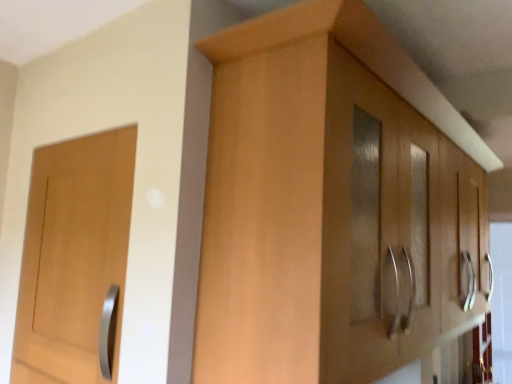
Question: Could you tell me if light wood cabinet at center is facing matte wood door at left?

Choices:
 (A) no
 (B) yes

Answer: (A)

Question: Considering the relative positions of light wood cabinet at center and matte wood door at left in the image provided, is light wood cabinet at center in front of matte wood door at left?

Choices:
 (A) no
 (B) yes

Answer: (B)

Question: Is light wood cabinet at center smaller than matte wood door at left?

Choices:
 (A) no
 (B) yes

Answer: (A)

Question: Is light wood cabinet at center looking in the opposite direction of matte wood door at left?

Choices:
 (A) yes
 (B) no

Answer: (A)

Question: Can you confirm if light wood cabinet at center is taller than matte wood door at left?

Choices:
 (A) yes
 (B) no

Answer: (A)

Question: Does light wood cabinet at center have a lesser width compared to matte wood door at left?

Choices:
 (A) yes
 (B) no

Answer: (B)

Question: Is matte wood door at left turned away from light wood cabinet at center?

Choices:
 (A) no
 (B) yes

Answer: (B)

Question: From the image's perspective, is matte wood door at left located beneath light wood cabinet at center?

Choices:
 (A) yes
 (B) no

Answer: (A)

Question: Is matte wood door at left wider than light wood cabinet at center?

Choices:
 (A) yes
 (B) no

Answer: (B)

Question: Is matte wood door at left positioned before light wood cabinet at center?

Choices:
 (A) yes
 (B) no

Answer: (B)

Question: Is the depth of matte wood door at left greater than that of light wood cabinet at center?

Choices:
 (A) no
 (B) yes

Answer: (B)

Question: Can you confirm if matte wood door at left is taller than light wood cabinet at center?

Choices:
 (A) no
 (B) yes

Answer: (A)

Question: Is light wood cabinet at center to the left or to the right of matte wood door at left in the image?

Choices:
 (A) right
 (B) left

Answer: (A)